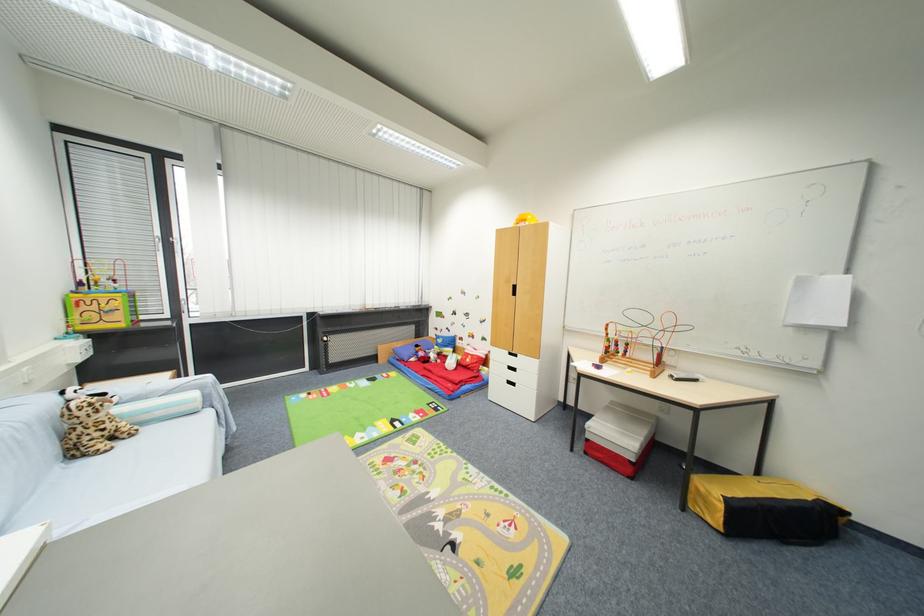
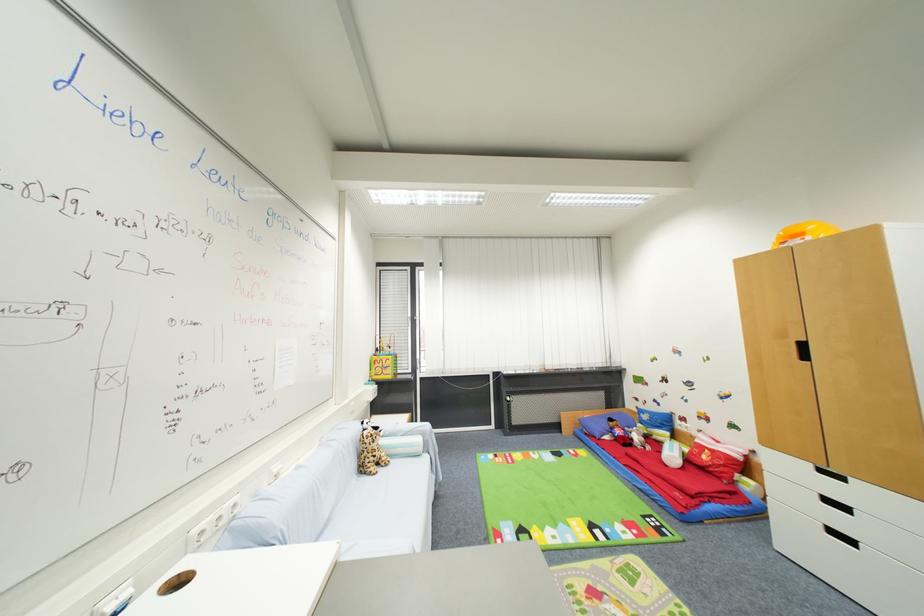
Where in the second image is the point corresponding to [438,387] from the first image?

(650, 488)